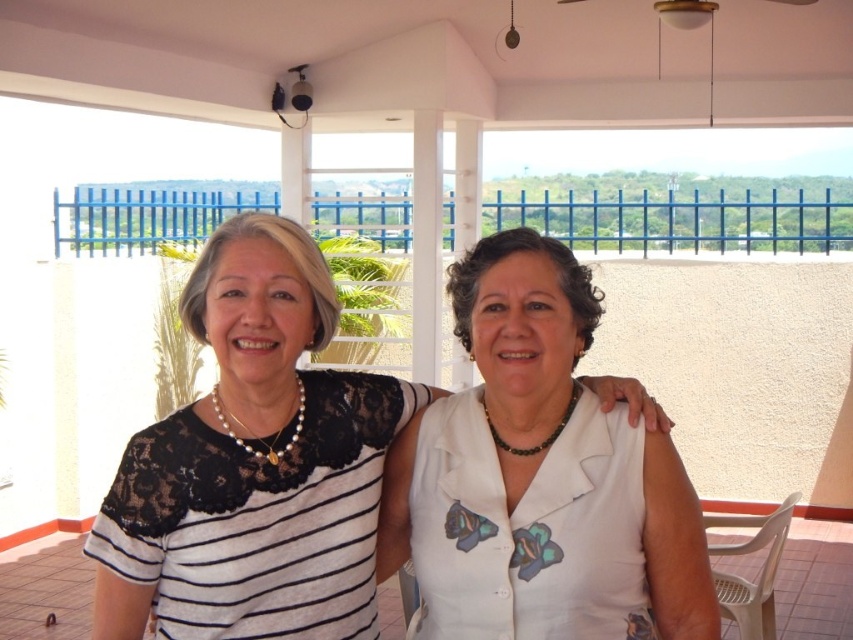
Is white lace top at center behind white fabric at center?

That is False.

Consider the image. Which is below, white lace top at center or white fabric at center?

Positioned lower is white fabric at center.

I want to click on white lace top at center, so click(253, 465).

Between white matte blouse at center and white fabric at center, which one is positioned higher?

white matte blouse at center

Which is below, white matte blouse at center or white fabric at center?

white fabric at center is lower down.

Does point (519, 541) lie behind point (842, 528)?

No.

Identify the location of white matte blouse at center. (538, 476).

Does white lace top at center appear over white matte blouse at center?

Correct, white lace top at center is located above white matte blouse at center.

Is the position of white lace top at center less distant than that of white matte blouse at center?

No, it is not.

Image resolution: width=853 pixels, height=640 pixels. What do you see at coordinates (253, 465) in the screenshot?
I see `white lace top at center` at bounding box center [253, 465].

Locate an element on the screen. Image resolution: width=853 pixels, height=640 pixels. white lace top at center is located at coordinates (253, 465).